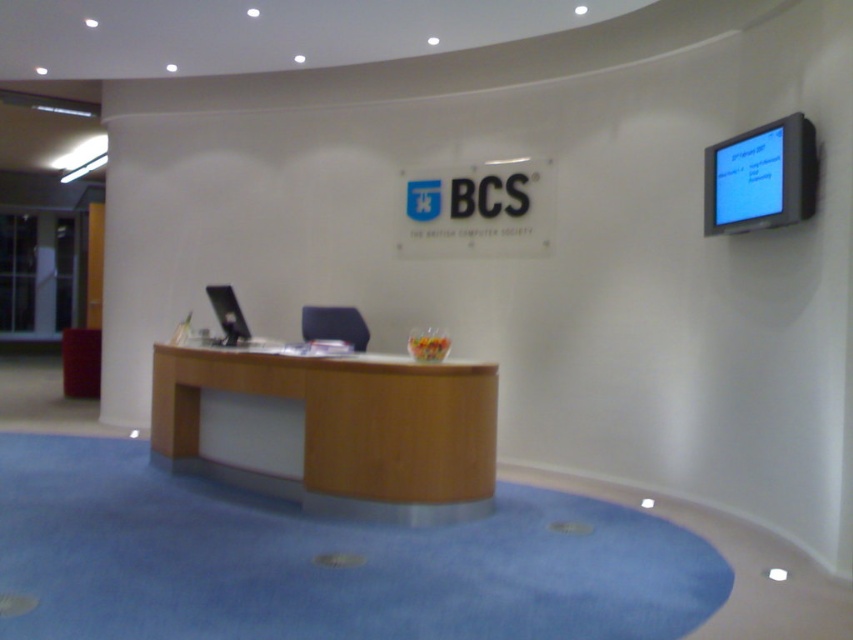
Is woodendesk at center to the left of white matte sign at center from the viewer's perspective?

Correct, you'll find woodendesk at center to the left of white matte sign at center.

The width and height of the screenshot is (853, 640). Describe the element at coordinates (332, 429) in the screenshot. I see `woodendesk at center` at that location.

Between point (347, 481) and point (491, 163), which one is positioned in front?

Point (347, 481) is more forward.

At what (x,y) coordinates should I click in order to perform the action: click on woodendesk at center. Please return your answer as a coordinate pair (x, y). Looking at the image, I should click on (332, 429).